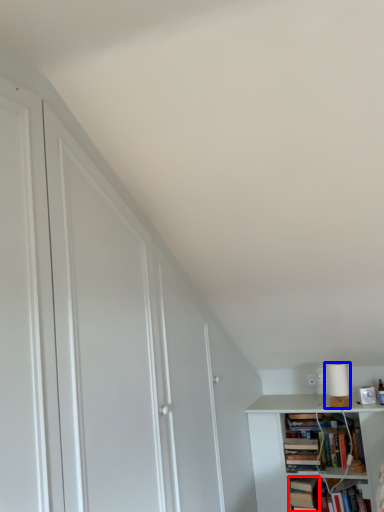
Question: Which object is closer to the camera taking this photo, book (highlighted by a red box) or lamp (highlighted by a blue box)?

Choices:
 (A) book
 (B) lamp

Answer: (A)